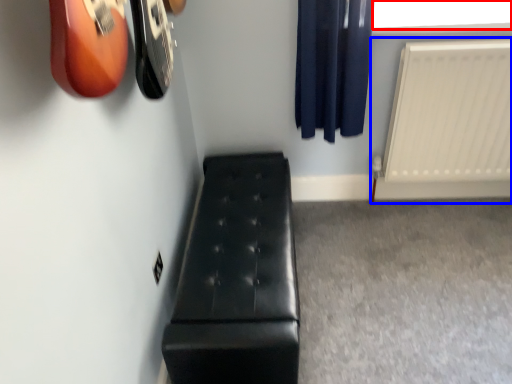
Question: Which point is closer to the camera, window screen (highlighted by a red box) or radiator (highlighted by a blue box)?

Choices:
 (A) window screen
 (B) radiator

Answer: (B)